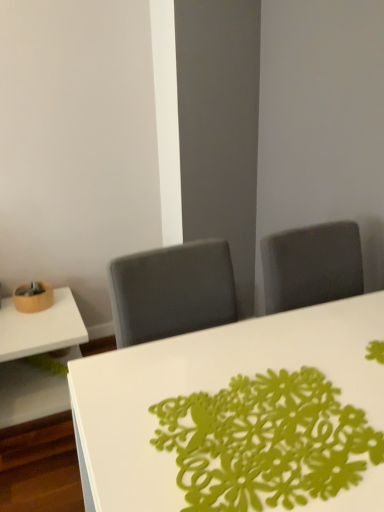
Question: Is white glossy table at lower left, arranged as the second table when viewed from the right, smaller than white glossy table at center, positioned as the 2th table in left-to-right order?

Choices:
 (A) yes
 (B) no

Answer: (A)

Question: From a real-world perspective, is white glossy table at lower left, the first table positioned from the left, on white glossy table at center, acting as the 1th table starting from the right?

Choices:
 (A) yes
 (B) no

Answer: (B)

Question: Can you confirm if white glossy table at lower left, arranged as the second table when viewed from the right, is shorter than white glossy table at center, the first table when ordered from front to back?

Choices:
 (A) yes
 (B) no

Answer: (A)

Question: Would you say white glossy table at lower left, the first table positioned from the left, contains white glossy table at center, acting as the 1th table starting from the right?

Choices:
 (A) yes
 (B) no

Answer: (B)

Question: Can you confirm if white glossy table at lower left, the first table positioned from the left, is taller than white glossy table at center, positioned as the 2th table in left-to-right order?

Choices:
 (A) yes
 (B) no

Answer: (B)

Question: Does white glossy table at lower left, which ranks as the first table in back-to-front order, have a greater width compared to white glossy table at center, positioned as the 2th table in left-to-right order?

Choices:
 (A) yes
 (B) no

Answer: (B)

Question: From the image's perspective, is white glossy table at center, the second table when ordered from back to front, below green paper doily at center?

Choices:
 (A) no
 (B) yes

Answer: (B)

Question: Is white glossy table at center, positioned as the 2th table in left-to-right order, facing towards green paper doily at center?

Choices:
 (A) no
 (B) yes

Answer: (A)

Question: Is white glossy table at center, the second table when ordered from back to front, wider than green paper doily at center?

Choices:
 (A) yes
 (B) no

Answer: (A)

Question: Does white glossy table at center, the second table when ordered from back to front, come behind green paper doily at center?

Choices:
 (A) yes
 (B) no

Answer: (B)

Question: From a real-world perspective, is white glossy table at center, the second table when ordered from back to front, beneath green paper doily at center?

Choices:
 (A) no
 (B) yes

Answer: (B)

Question: Considering the relative sizes of white glossy table at center, acting as the 1th table starting from the right, and green paper doily at center in the image provided, is white glossy table at center, acting as the 1th table starting from the right, thinner than green paper doily at center?

Choices:
 (A) no
 (B) yes

Answer: (A)

Question: Is green paper doily at center not within white glossy table at lower left, the first table positioned from the left?

Choices:
 (A) no
 (B) yes

Answer: (B)